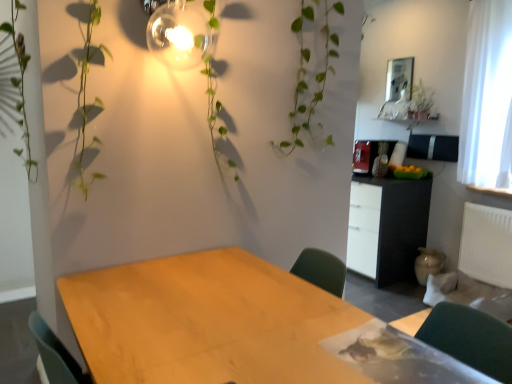
Where is `vacant space in matte glass light fixture at upper center (from a real-world perspective)`? This screenshot has height=384, width=512. vacant space in matte glass light fixture at upper center (from a real-world perspective) is located at coordinates (176, 266).